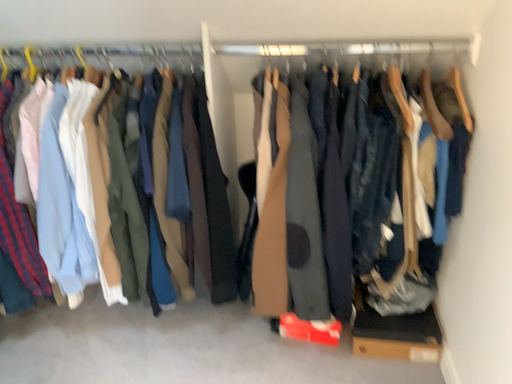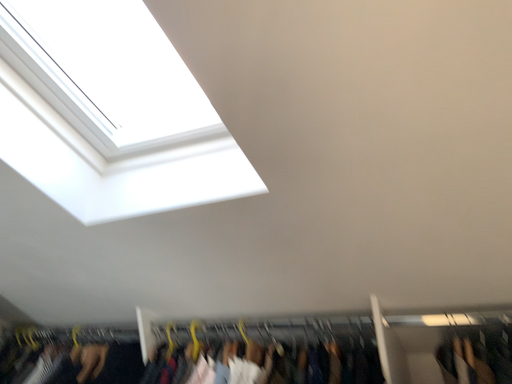
Question: Which way did the camera rotate in the video?

Choices:
 (A) rotated upward
 (B) rotated downward

Answer: (A)